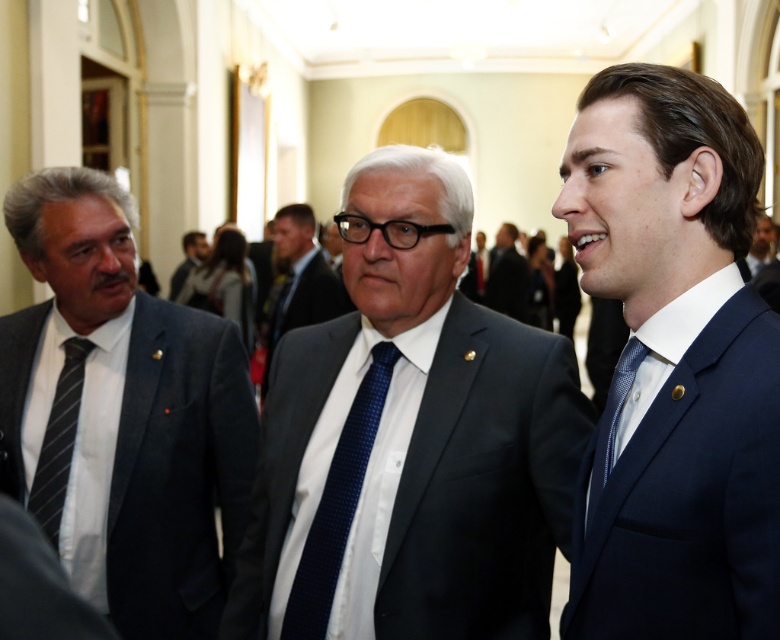
In the conference scene, there are two men wearing the matte black suit at center and the navy blue suit at right. Which one is positioned lower in the image?

The matte black suit at center is positioned lower than the navy blue suit at right.

In the scene described, there are two men wearing a navy blue suit at right and a light brown leather jacket at center. Which of these two items of clothing is taller?

The navy blue suit at right is taller than the light brown leather jacket at center.